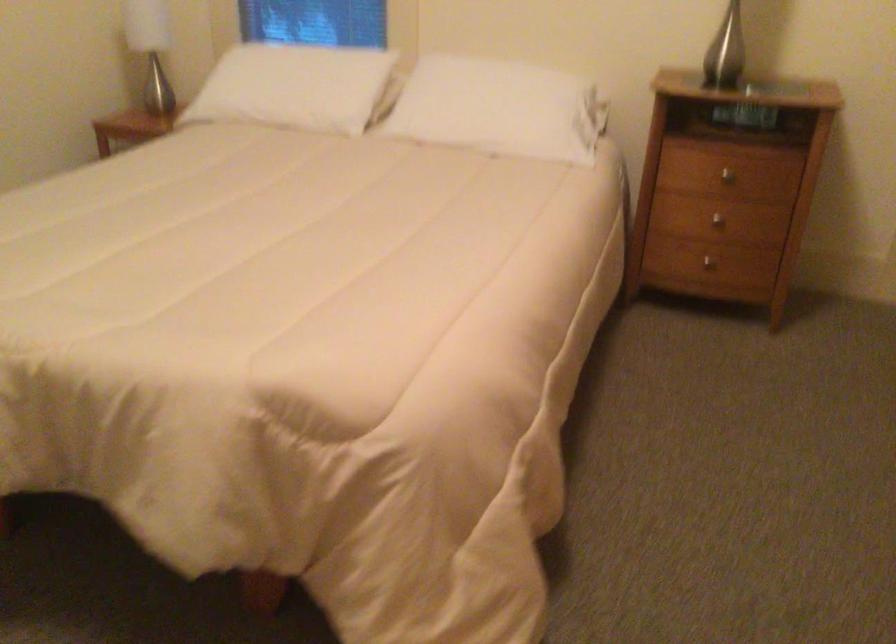
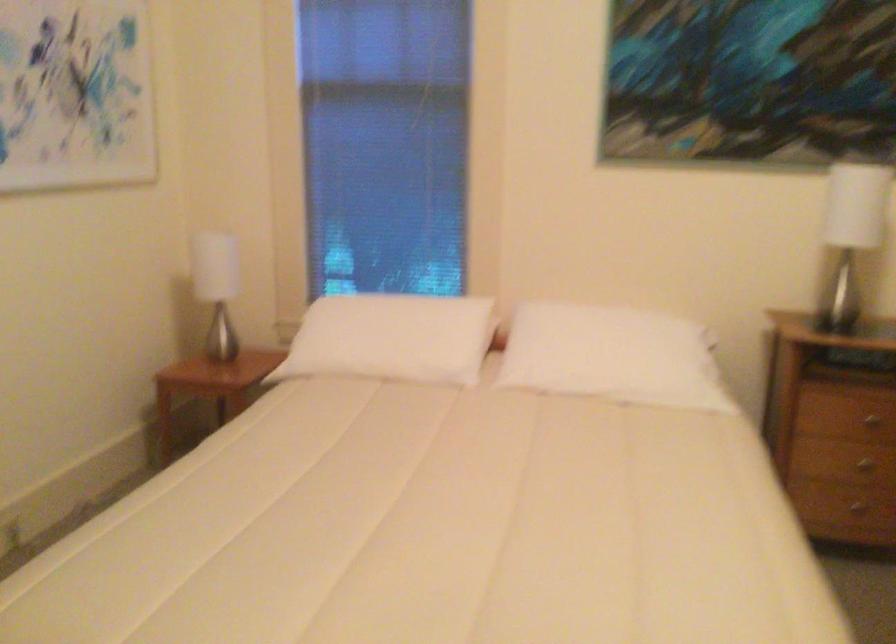
Question: What movement of the cameraman would produce the second image?

Choices:
 (A) Left
 (B) Right
 (C) Forward
 (D) Backward

Answer: (A)